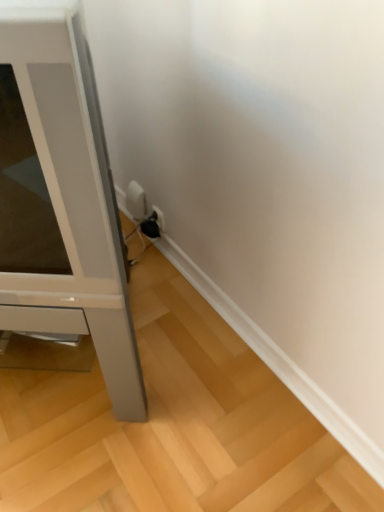
The height and width of the screenshot is (512, 384). What do you see at coordinates (61, 197) in the screenshot?
I see `white glossy tv stand at left` at bounding box center [61, 197].

Locate an element on the screen. white glossy tv stand at left is located at coordinates (61, 197).

Where is `white glossy tv stand at left`? The height and width of the screenshot is (512, 384). white glossy tv stand at left is located at coordinates (61, 197).